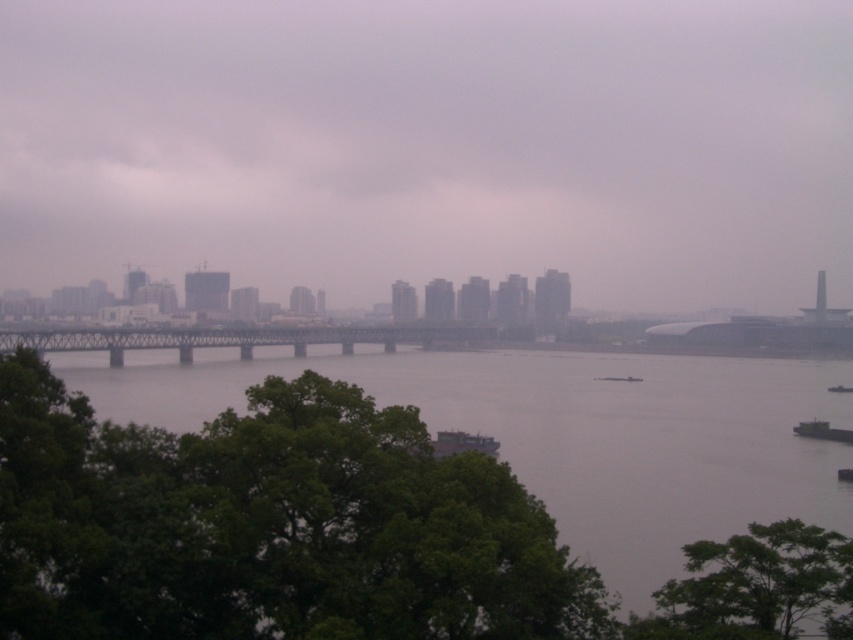
You are an architect evaluating the cityscape. You need to determine which object occupies more visual space in the image between the matte gray bridge at center and the green leafy tree at lower right. Based on the scene, which one is bigger?

The matte gray bridge at center is larger in size than the green leafy tree at lower right, so it occupies more visual space in the image.

From the picture: You are an urban planner reviewing this cityscape image. You need to determine if the green leafy tree at lower right is positioned in front of or behind the matte gray bridge at center. Based on the scene, what is its position?

The green leafy tree at lower right is behind the matte gray bridge at center, so it is positioned behind the bridge.